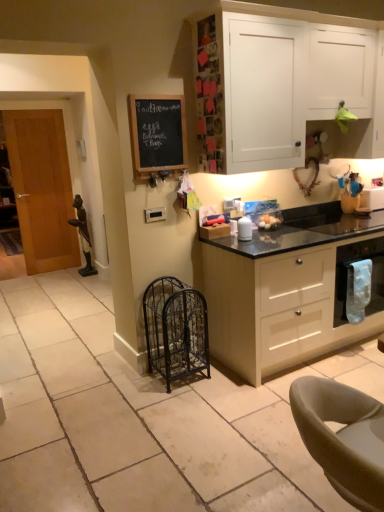
Find the location of a particular element. free space in front of black wrought iron cage at lower center is located at coordinates (176, 403).